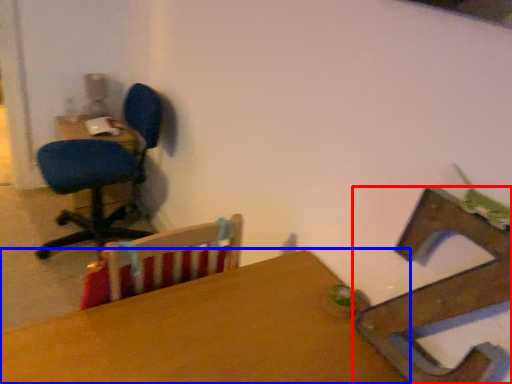
Question: Which object is further to the camera taking this photo, chair (highlighted by a red box) or table (highlighted by a blue box)?

Choices:
 (A) chair
 (B) table

Answer: (A)